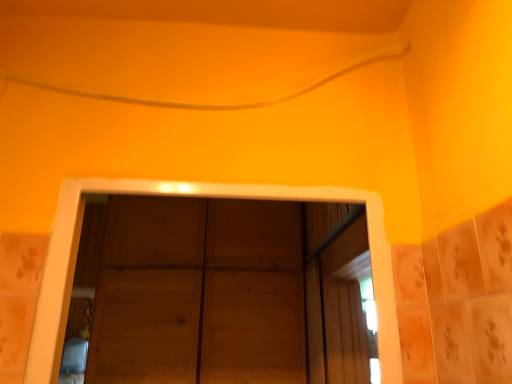
Measure the distance between wooden barn door at center and camera.

wooden barn door at center is 7.22 feet from camera.

You are a GUI agent. You are given a task and a screenshot of the screen. Output one action in this format:
    pyautogui.click(x=<x>, y=<y>)
    Task: Click on the wooden barn door at center
    
    Given the screenshot: What is the action you would take?
    pyautogui.click(x=200, y=293)

What do you see at coordinates (200, 293) in the screenshot?
I see `wooden barn door at center` at bounding box center [200, 293].

The image size is (512, 384). I want to click on wooden barn door at center, so click(200, 293).